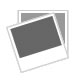
Locate an element on the screen. Image resolution: width=80 pixels, height=80 pixels. straight picture is located at coordinates (36, 14).